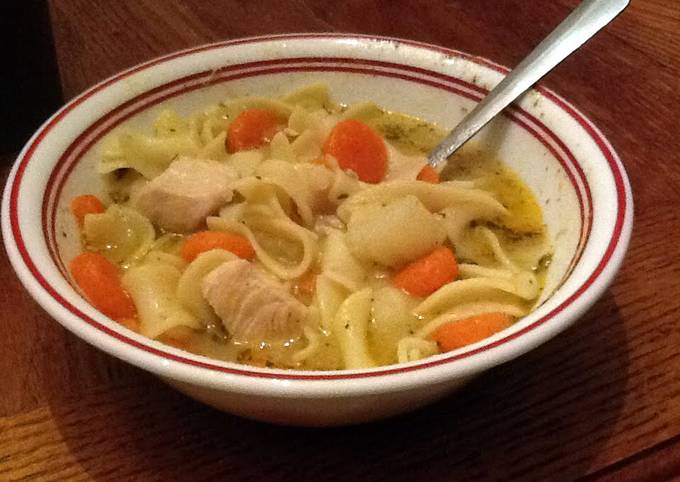
I want to click on single red stripe on rim of bowl, so click(x=86, y=90), click(x=192, y=51), click(x=453, y=51), click(x=590, y=127).